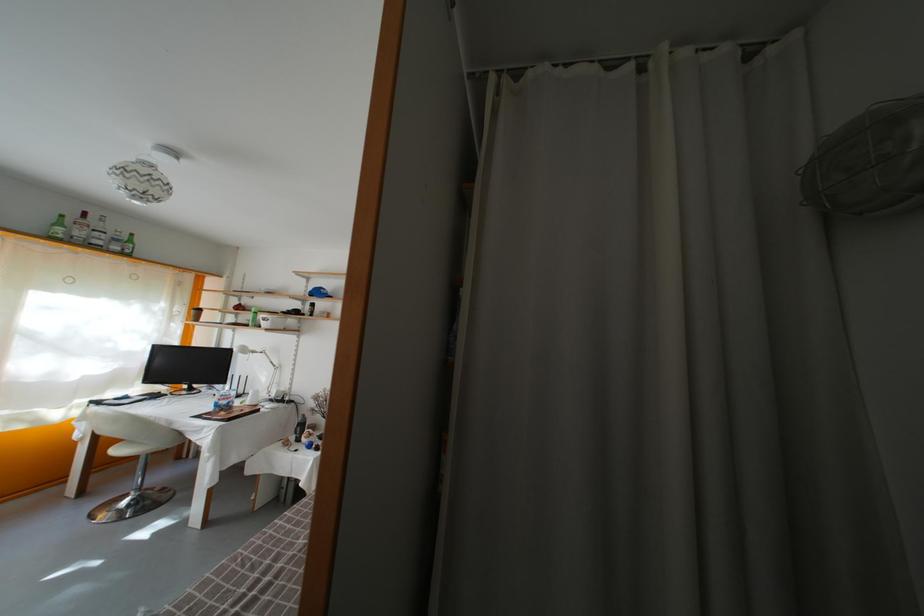
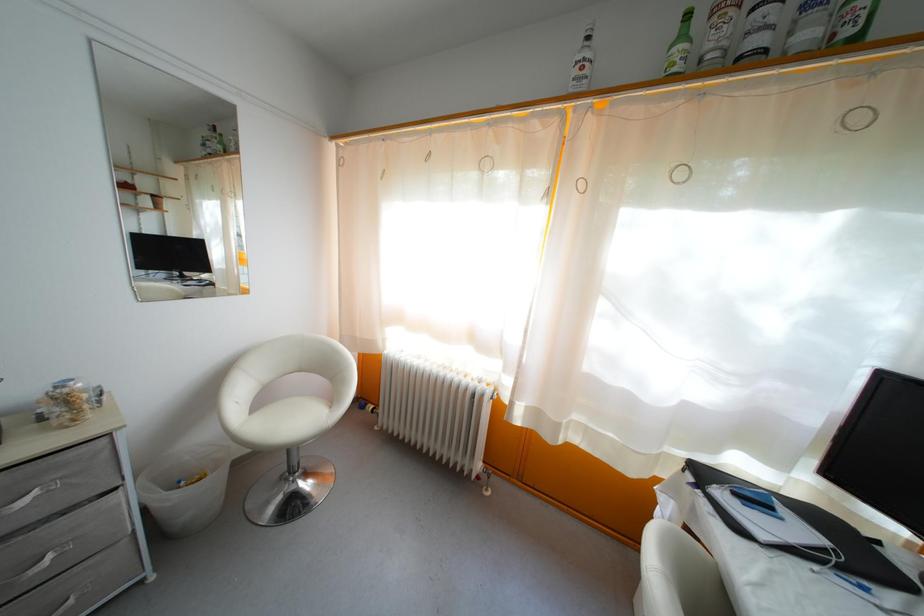
Find the pixel in the second image that matches point 67,230 in the first image.

(688, 43)